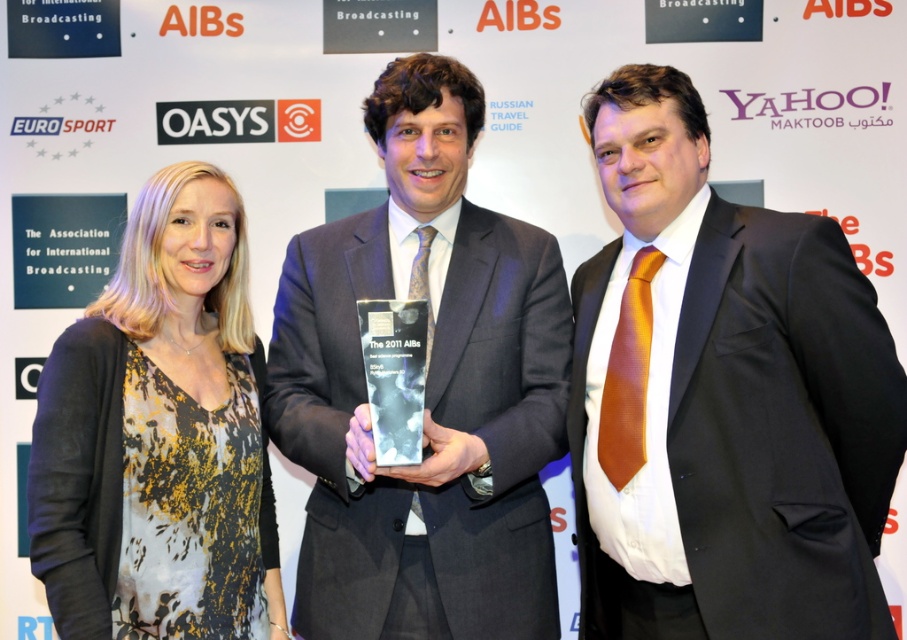
Based on the photo, you are a photographer taking a picture of the matte black suit at center and the printed silk blouse at left. Which one should you focus on to ensure it appears clearer in the photo?

The matte black suit at center is closer to the viewer than the printed silk blouse at left, so focusing on the matte black suit at center will ensure it appears clearer in the photo.

You are a fashion designer observing the scene. You notice two suits at the center of the image labeled as black satin suit at center and matte black suit at center. Which one is shorter in height?

The black satin suit at center has a lesser height compared to matte black suit at center, so the black satin suit at center is shorter in height.